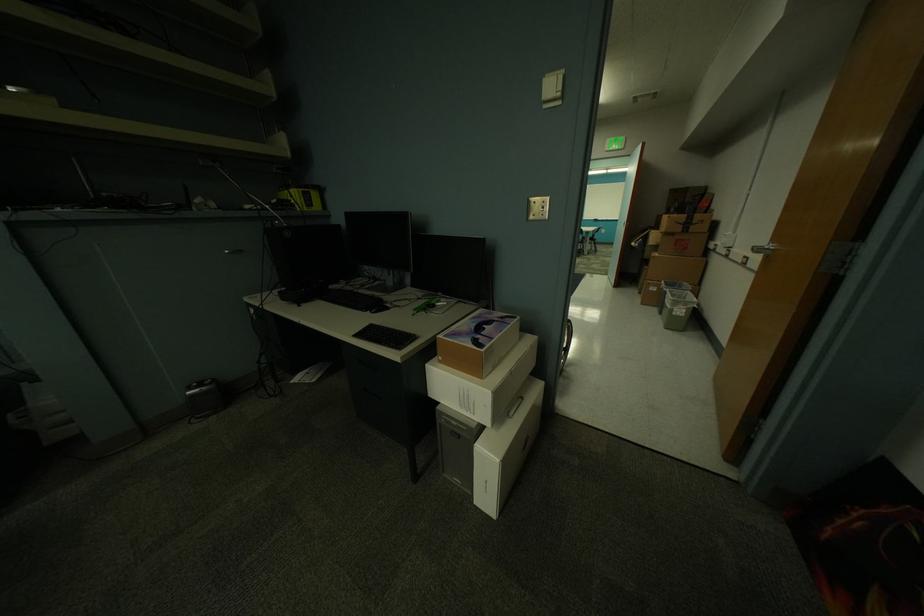
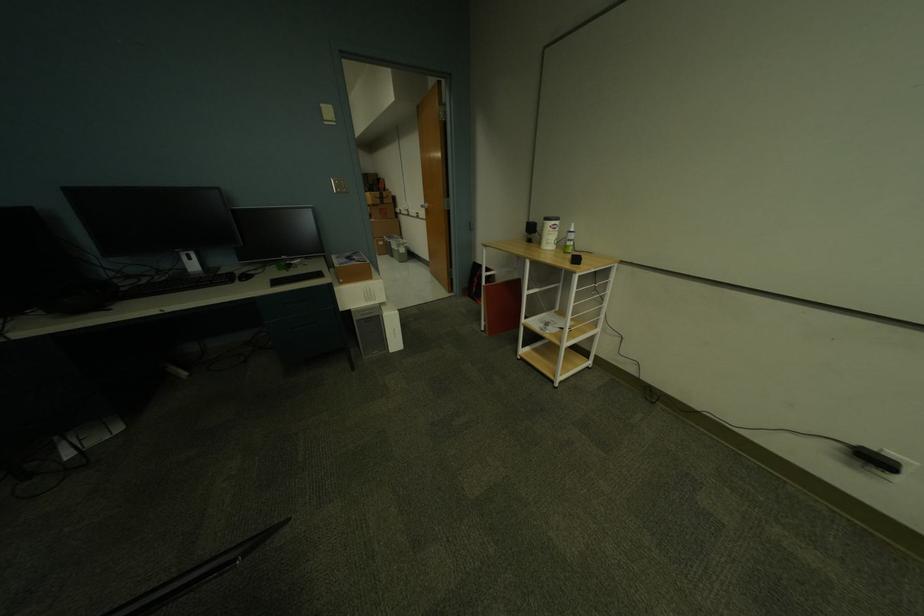
The point at (754, 265) is marked in the first image. Where is the corresponding point in the second image?

(427, 217)